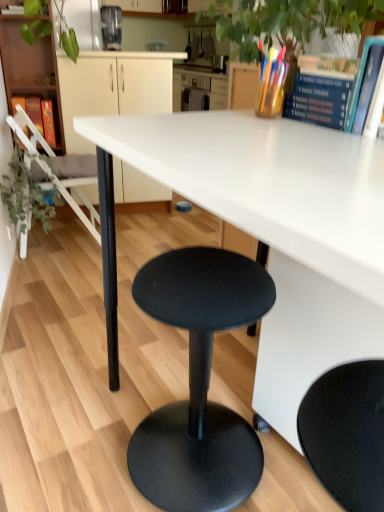
Question: Is blue hardcover book at upper right, which is counted as the first book, starting from the right, positioned with its back to white matte desk at center?

Choices:
 (A) no
 (B) yes

Answer: (A)

Question: Does blue hardcover book at upper right, the 2th book in the top-to-bottom sequence, have a lesser height compared to white matte desk at center?

Choices:
 (A) no
 (B) yes

Answer: (B)

Question: Is blue hardcover book at upper right, the 2th book in the top-to-bottom sequence, wider than white matte desk at center?

Choices:
 (A) yes
 (B) no

Answer: (B)

Question: Is blue hardcover book at upper right, which is counted as the first book, starting from the right, to the right of white matte desk at center from the viewer's perspective?

Choices:
 (A) no
 (B) yes

Answer: (B)

Question: Is blue hardcover book at upper right, the 3th book from the back, far away from white matte desk at center?

Choices:
 (A) yes
 (B) no

Answer: (B)

Question: Considering the positions of metallic gray coffee machine at upper center, which appears as the second appliance when viewed from the left, and white matte cabinet at center in the image, is metallic gray coffee machine at upper center, which appears as the second appliance when viewed from the left, taller or shorter than white matte cabinet at center?

Choices:
 (A) short
 (B) tall

Answer: (A)

Question: Relative to white matte cabinet at center, is metallic gray coffee machine at upper center, the first appliance in the right-to-left sequence, in front or behind?

Choices:
 (A) behind
 (B) front

Answer: (A)

Question: From the image's perspective, is metallic gray coffee machine at upper center, which appears as the second appliance when viewed from the left, above or below white matte cabinet at center?

Choices:
 (A) below
 (B) above

Answer: (B)

Question: Considering the positions of metallic gray coffee machine at upper center, the first appliance in the right-to-left sequence, and white matte cabinet at center in the image, is metallic gray coffee machine at upper center, the first appliance in the right-to-left sequence, wider or thinner than white matte cabinet at center?

Choices:
 (A) wide
 (B) thin

Answer: (B)

Question: Considering the positions of point (110, 26) and point (89, 204), is point (110, 26) closer or farther from the camera than point (89, 204)?

Choices:
 (A) farther
 (B) closer

Answer: (A)

Question: Is metallic gray coffee machine at upper center, which appears as the second appliance when viewed from the left, taller or shorter than white plastic chair at left?

Choices:
 (A) tall
 (B) short

Answer: (B)

Question: Is metallic gray coffee machine at upper center, which appears as the second appliance when viewed from the left, inside or outside of white plastic chair at left?

Choices:
 (A) inside
 (B) outside

Answer: (B)

Question: Based on their sizes in the image, would you say metallic gray coffee machine at upper center, which appears as the second appliance when viewed from the left, is bigger or smaller than white plastic chair at left?

Choices:
 (A) big
 (B) small

Answer: (B)

Question: Would you say matte wood bookshelf at left is inside or outside white plastic chair at left?

Choices:
 (A) outside
 (B) inside

Answer: (A)

Question: In the image, is matte wood bookshelf at left positioned in front of or behind white plastic chair at left?

Choices:
 (A) front
 (B) behind

Answer: (B)